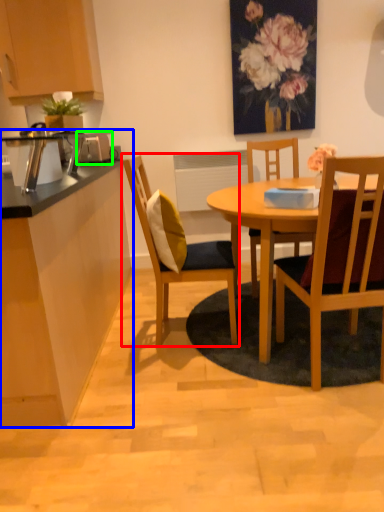
Question: Which object is positioned farthest from chair (highlighted by a red box)? Select from desk (highlighted by a blue box) and appliance (highlighted by a green box).

Choices:
 (A) desk
 (B) appliance

Answer: (B)